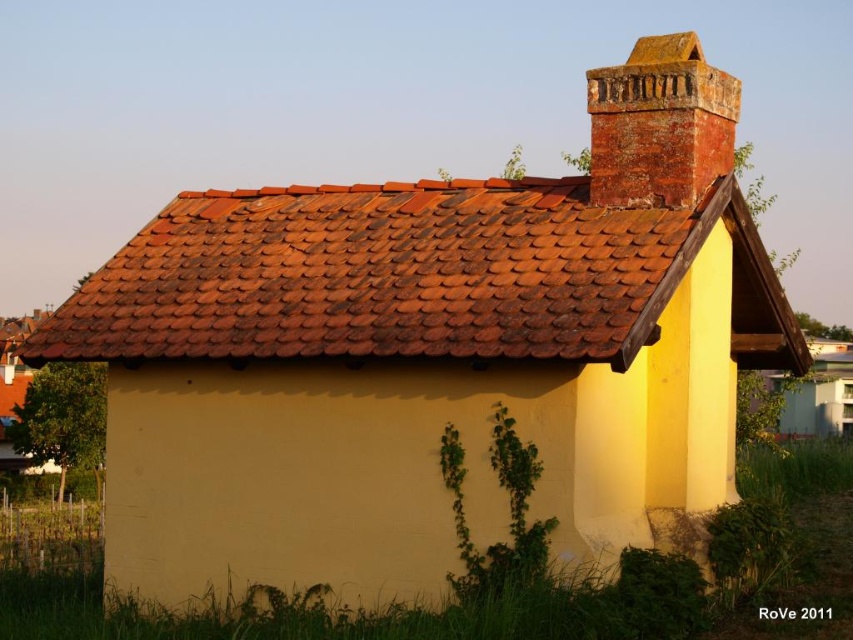
Can you confirm if rusty clay tiles at upper center is wider than rusty brick chimney at upper right?

Yes, rusty clay tiles at upper center is wider than rusty brick chimney at upper right.

Can you confirm if rusty clay tiles at upper center is positioned above rusty brick chimney at upper right?

No, rusty clay tiles at upper center is not above rusty brick chimney at upper right.

Does point (422, 180) come behind point (643, 180)?

Yes.

This screenshot has width=853, height=640. I want to click on rusty clay tiles at upper center, so click(386, 275).